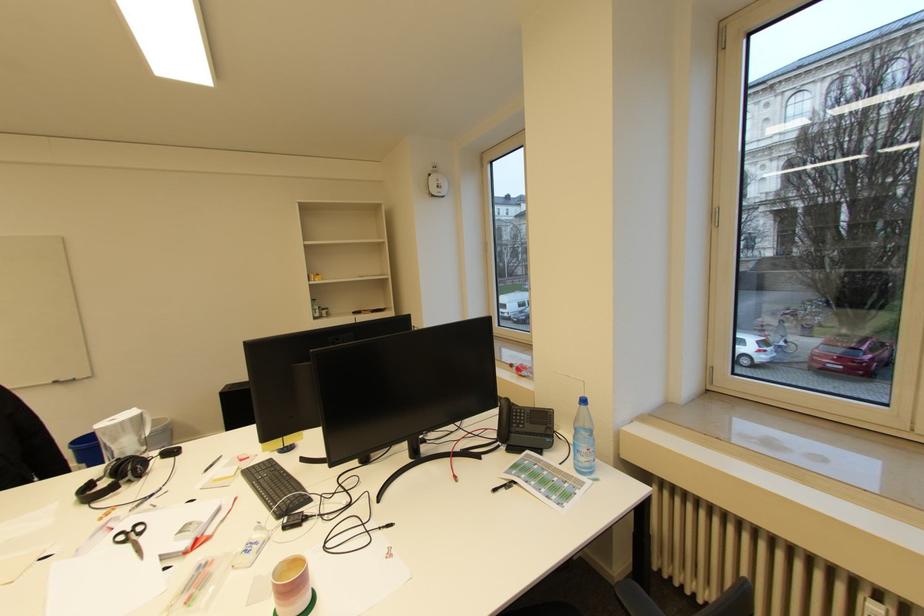
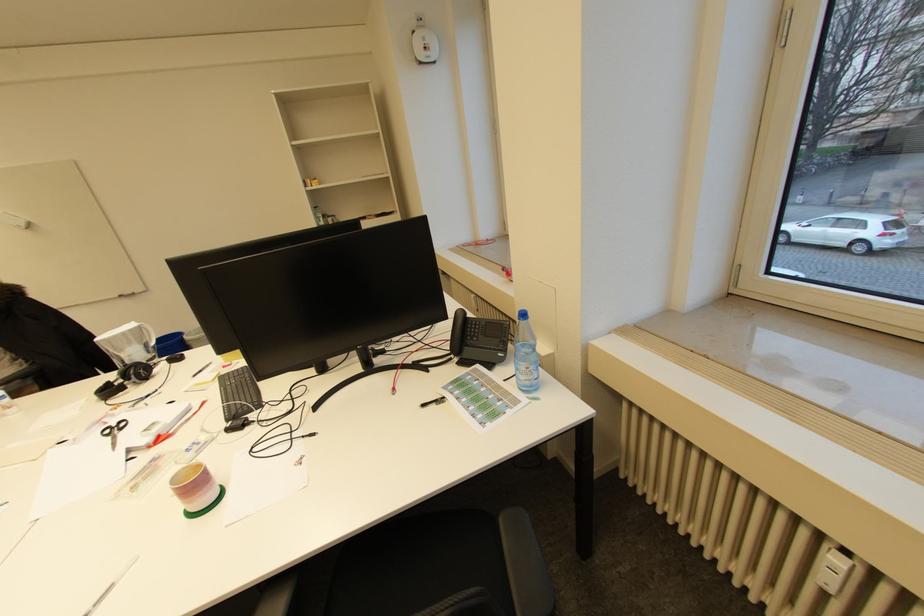
The point at (136,472) is marked in the first image. Where is the corresponding point in the second image?

(140, 377)